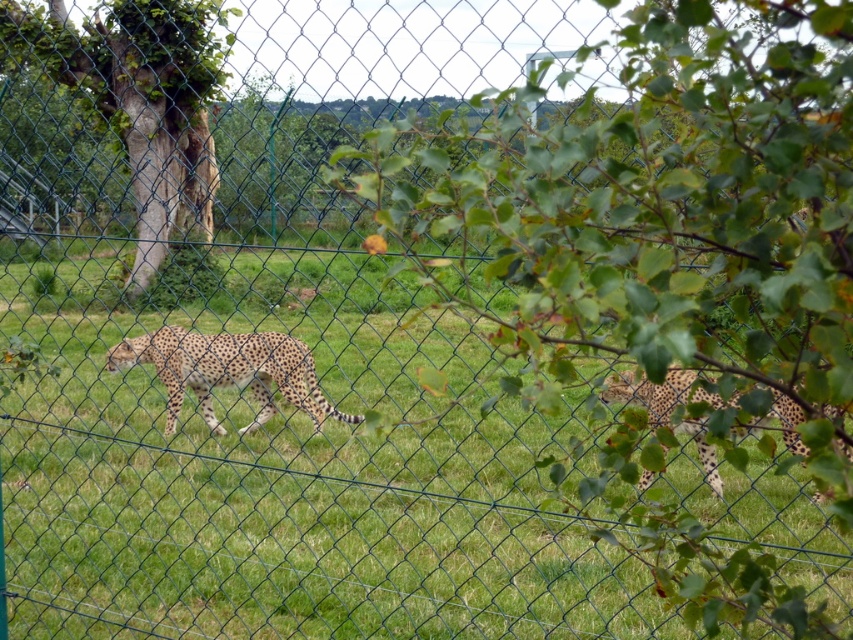
Is spotted fur cheetah at center above spotted fur cheetah at right?

Actually, spotted fur cheetah at center is below spotted fur cheetah at right.

Which is in front, point (164, 355) or point (672, 394)?

Point (672, 394) is in front.

The height and width of the screenshot is (640, 853). In order to click on spotted fur cheetah at center in this screenshot , I will do `click(228, 371)`.

Does green rough bark tree at left come behind spotted fur cheetah at right?

That is True.

Identify the location of green rough bark tree at left. (140, 100).

Who is more distant from viewer, (148,224) or (221,428)?

The point (148,224) is behind.

Is green rough bark tree at left behind spotted fur cheetah at center?

That is True.

Which is in front, point (180, 13) or point (306, 365)?

Point (306, 365) is in front.

The height and width of the screenshot is (640, 853). Find the location of `green rough bark tree at left`. green rough bark tree at left is located at coordinates (140, 100).